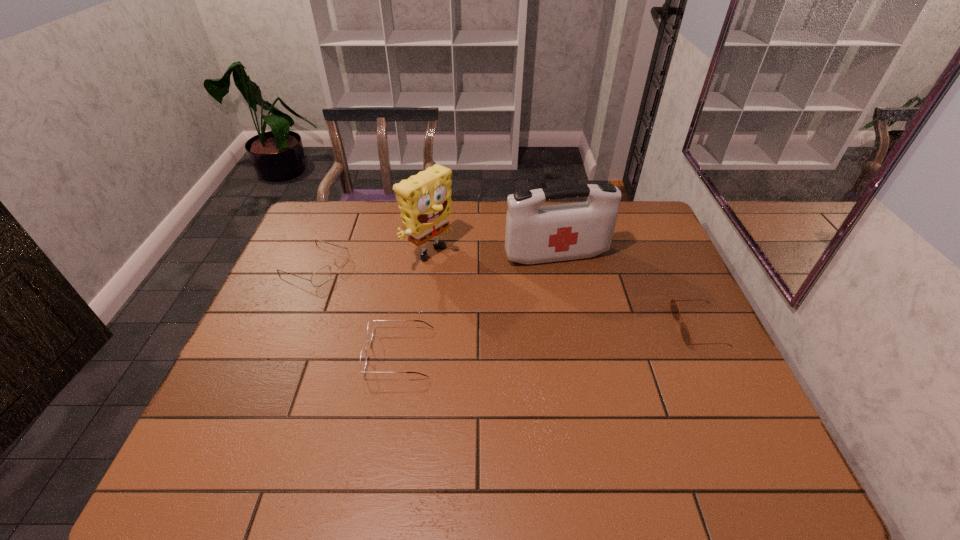
You are a GUI agent. You are given a task and a screenshot of the screen. Output one action in this format:
    pyautogui.click(x=<x>, y=<y>)
    Task: Click on the vacant space located on the front-facing side of the leftmost object
    
    Given the screenshot: What is the action you would take?
    pyautogui.click(x=454, y=320)

You are a GUI agent. You are given a task and a screenshot of the screen. Output one action in this format:
    pyautogui.click(x=<x>, y=<y>)
    Task: Click on the vacant space situated on the front-facing side of the leftmost object
    The height and width of the screenshot is (540, 960).
    Given the screenshot: What is the action you would take?
    pyautogui.click(x=435, y=313)

Where is `object located in the far edge section of the desktop`? object located in the far edge section of the desktop is located at coordinates (424, 200).

This screenshot has width=960, height=540. What are the coordinates of `object present at the left edge` in the screenshot? It's located at (322, 275).

Image resolution: width=960 pixels, height=540 pixels. I want to click on object located in the right edge section of the desktop, so click(685, 333).

In the image, there is a desktop. Where is `free space at the far edge`? The height and width of the screenshot is (540, 960). free space at the far edge is located at coordinates (571, 201).

The width and height of the screenshot is (960, 540). What are the coordinates of `vacant space at the near edge of the desktop` in the screenshot? It's located at (396, 401).

Find the location of a particular element. The image size is (960, 540). free space at the left edge is located at coordinates (262, 359).

Find the location of `vacant region at the right edge`. vacant region at the right edge is located at coordinates [x=660, y=332].

The image size is (960, 540). In order to click on free space at the near right corner of the desktop in this screenshot , I will do `click(713, 421)`.